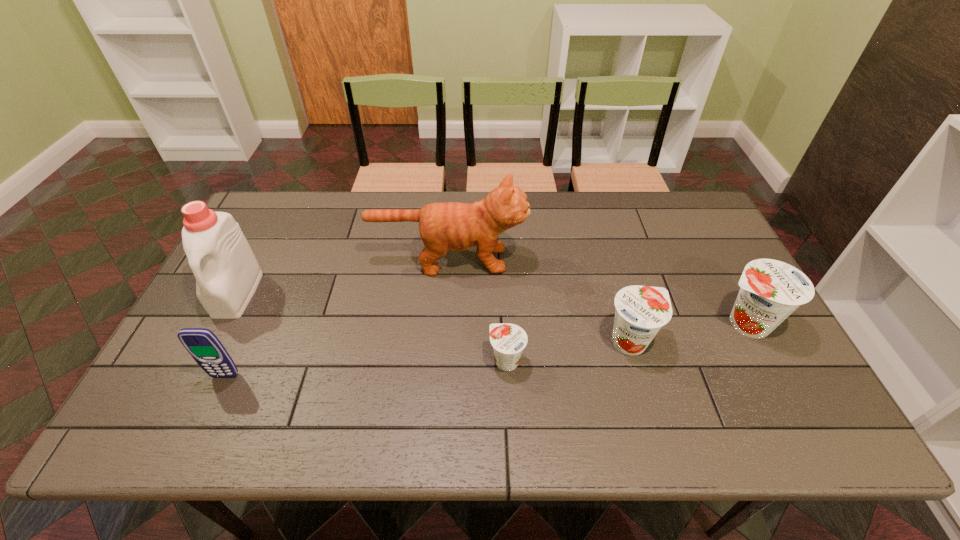
Locate an element on the screen. This screenshot has height=540, width=960. vacant space at the near edge of the desktop is located at coordinates (331, 376).

The image size is (960, 540). Find the location of `vacant space at the left edge of the desktop`. vacant space at the left edge of the desktop is located at coordinates (261, 254).

The width and height of the screenshot is (960, 540). In order to click on vacant space at the right edge of the desktop in this screenshot , I will do `click(721, 266)`.

I want to click on vacant space at the far left corner of the desktop, so click(304, 199).

Identify the location of vacant space at the far right corner of the desktop. (700, 228).

The image size is (960, 540). What are the coordinates of `vacant space that's between the fifth tallest object and the cellular telephone` in the screenshot? It's located at (428, 359).

You are a GUI agent. You are given a task and a screenshot of the screen. Output one action in this format:
    pyautogui.click(x=<x>, y=<y>)
    Task: Click on the free space that is in between the detergent and the rightmost yogurt
    This screenshot has width=960, height=540.
    Given the screenshot: What is the action you would take?
    pyautogui.click(x=492, y=308)

Find the location of a particular element. vacant point located between the detergent and the cellular telephone is located at coordinates (231, 335).

The image size is (960, 540). Identify the location of vacant space in between the second yogurt from right to left and the rightmost yogurt. (687, 333).

I want to click on empty location between the cellular telephone and the second tallest yogurt, so click(x=428, y=359).